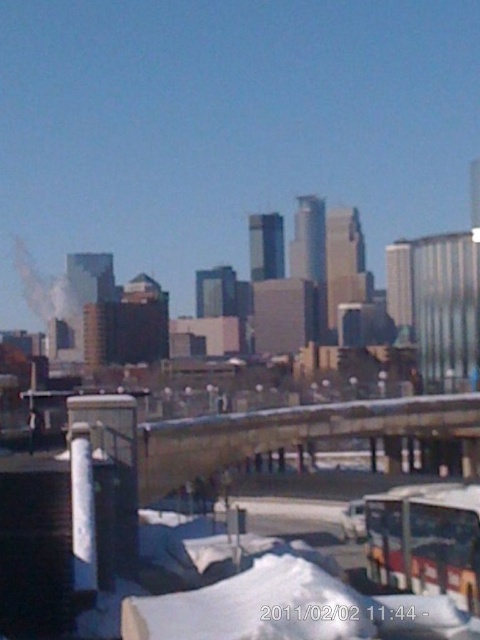
Question: From the image, what is the correct spatial relationship of metallic silver bus at lower right in relation to white smoke at left?

Choices:
 (A) left
 (B) right

Answer: (B)

Question: Does metallic silver bus at lower right appear over white smoke at left?

Choices:
 (A) yes
 (B) no

Answer: (B)

Question: Which point appears farthest from the camera in this image?

Choices:
 (A) (39, 289)
 (B) (399, 568)

Answer: (A)

Question: Does metallic silver bus at lower right have a larger size compared to white smoke at left?

Choices:
 (A) yes
 (B) no

Answer: (B)